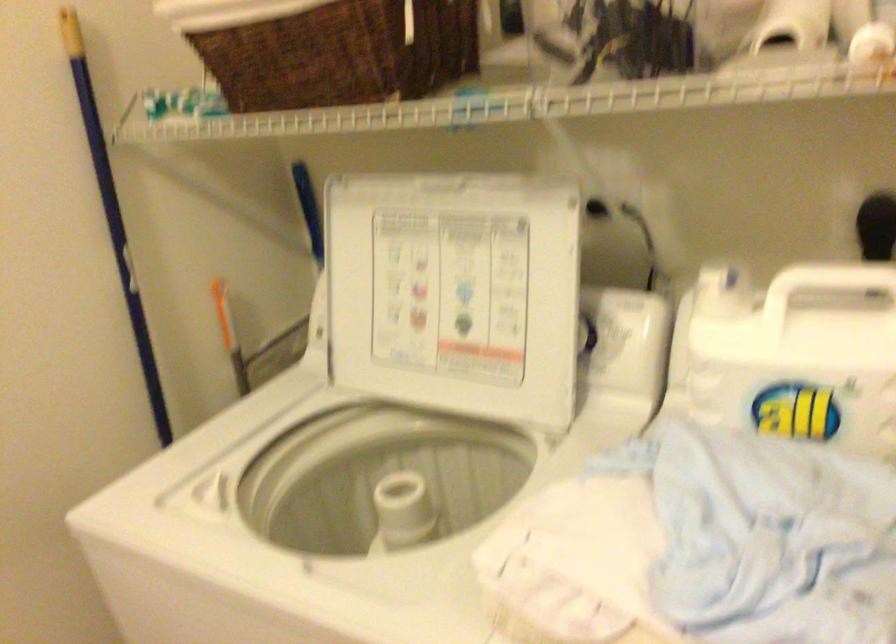
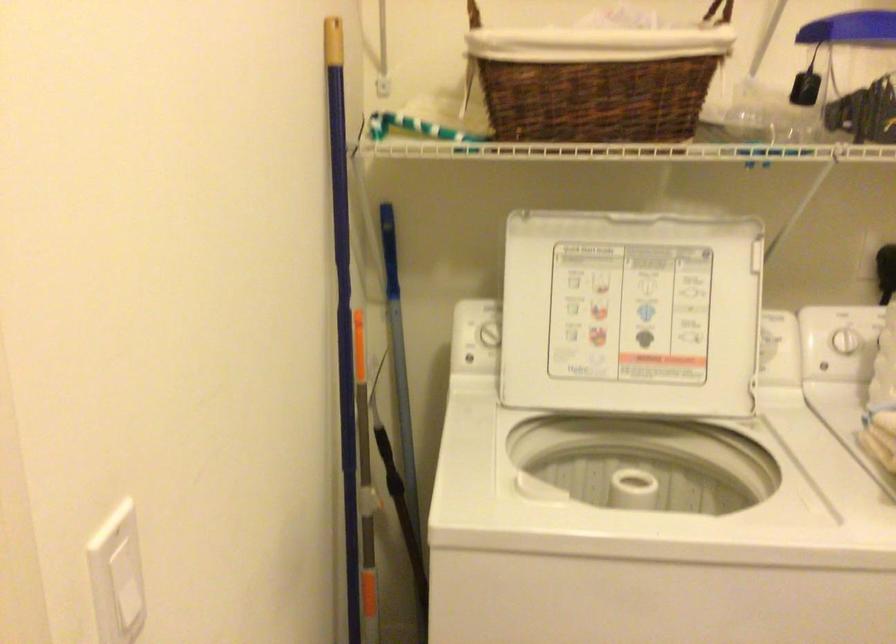
Locate, in the second image, the point that corresponds to the point at 134,295 in the first image.

(343, 316)